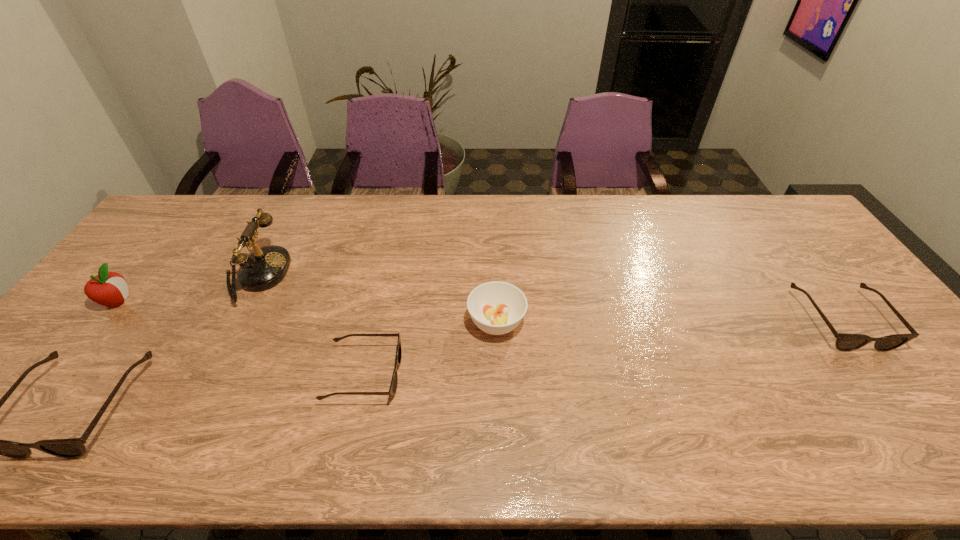
Where is `vacant space at the near left corner of the desktop`? vacant space at the near left corner of the desktop is located at coordinates (15, 396).

Find the location of a particular element. free space at the far right corner of the desktop is located at coordinates (767, 195).

In order to click on blank region between the shortest sunglasses and the telephone in this screenshot , I will do `click(310, 325)`.

Identify the location of free space that is in between the fifth object from left to right and the second tallest sunglasses. Image resolution: width=960 pixels, height=540 pixels. pos(668,321).

Where is `vacant space that is in between the fourth object from right to left and the fifth shortest object`? This screenshot has width=960, height=540. vacant space that is in between the fourth object from right to left and the fifth shortest object is located at coordinates (187, 288).

The image size is (960, 540). I want to click on vacant space in between the fifth shortest object and the soup bowl, so click(307, 312).

I want to click on empty space between the third object from left to right and the second tallest object, so click(187, 288).

You are a GUI agent. You are given a task and a screenshot of the screen. Output one action in this format:
    pyautogui.click(x=<x>, y=<y>)
    Task: Click on the free spot between the fifth shortest object and the third object from left to right
    Image resolution: width=960 pixels, height=540 pixels.
    Given the screenshot: What is the action you would take?
    pyautogui.click(x=187, y=288)

At what (x,y) coordinates should I click in order to perform the action: click on empty location between the fourth object from left to right and the soup bowl. Please return your answer as a coordinate pair (x, y). The height and width of the screenshot is (540, 960). Looking at the image, I should click on (430, 348).

Locate an element on the screen. The height and width of the screenshot is (540, 960). vacant area that lies between the tallest object and the second shortest sunglasses is located at coordinates (548, 298).